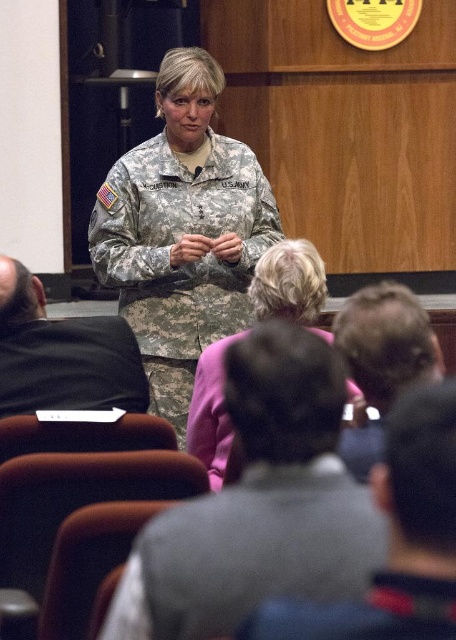
Does camouflage fabric uniform at center have a greater width compared to gray fabric shirt at lower center?

Indeed, camouflage fabric uniform at center has a greater width compared to gray fabric shirt at lower center.

Who is more forward, (233,205) or (395,611)?

Point (395,611) is in front.

The width and height of the screenshot is (456, 640). Find the location of `camouflage fabric uniform at center`. camouflage fabric uniform at center is located at coordinates point(186,259).

Image resolution: width=456 pixels, height=640 pixels. What do you see at coordinates (397, 538) in the screenshot?
I see `gray fabric shirt at lower center` at bounding box center [397, 538].

Who is more distant from viewer, [429,385] or [10,413]?

Positioned behind is point [10,413].

What do you see at coordinates (397, 538) in the screenshot? I see `gray fabric shirt at lower center` at bounding box center [397, 538].

Where is `gray fabric shirt at lower center`? Image resolution: width=456 pixels, height=640 pixels. gray fabric shirt at lower center is located at coordinates (397, 538).

Is the position of black cotton shirt at lower left more distant than that of pink fabric jacket at center?

Yes, black cotton shirt at lower left is behind pink fabric jacket at center.

You are a GUI agent. You are given a task and a screenshot of the screen. Output one action in this format:
    pyautogui.click(x=<x>, y=<y>)
    Task: Click on the black cotton shirt at lower left
    
    Given the screenshot: What is the action you would take?
    pyautogui.click(x=62, y=355)

The height and width of the screenshot is (640, 456). What do you see at coordinates (62, 355) in the screenshot? I see `black cotton shirt at lower left` at bounding box center [62, 355].

I want to click on black cotton shirt at lower left, so pos(62,355).